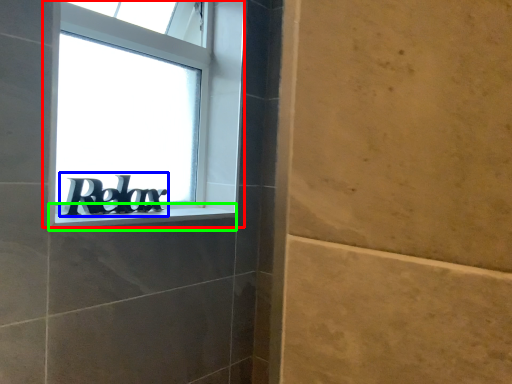
Question: Considering the real-world distances, which object is closest to window (highlighted by a red box)? number (highlighted by a blue box) or window sill (highlighted by a green box).

Choices:
 (A) number
 (B) window sill

Answer: (A)